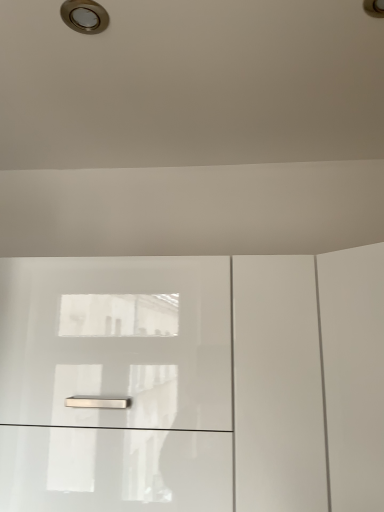
Locate an element on the screen. vacant space behind brushed metal droplight at upper left is located at coordinates (116, 67).